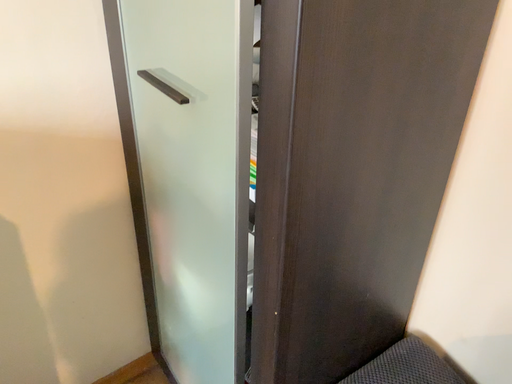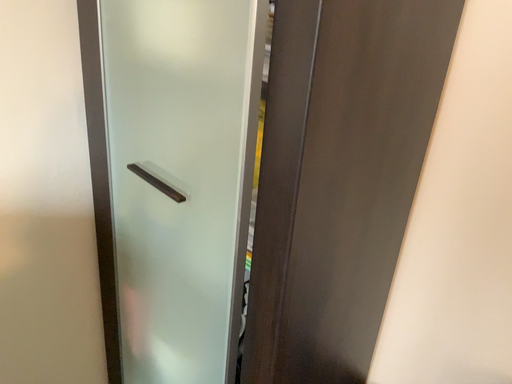
Question: How did the camera likely rotate when shooting the video?

Choices:
 (A) rotated right
 (B) rotated left

Answer: (A)